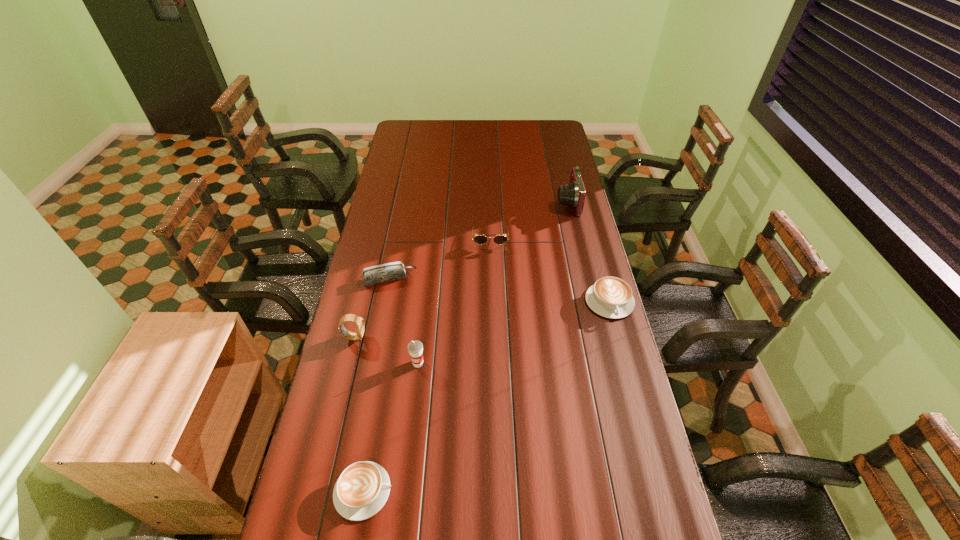
Identify the location of vacant space at the right edge of the desktop. (609, 456).

You are a GUI agent. You are given a task and a screenshot of the screen. Output one action in this format:
    pyautogui.click(x=<x>, y=<y>)
    Task: Click on the free spot at the far left corner of the desktop
    Image resolution: width=960 pixels, height=540 pixels.
    Given the screenshot: What is the action you would take?
    pyautogui.click(x=411, y=140)

Find the location of a particular element. The width and height of the screenshot is (960, 540). free space at the far right corner is located at coordinates (554, 131).

Where is `vacant space that's between the second nearest object and the fifth object from left to right`? vacant space that's between the second nearest object and the fifth object from left to right is located at coordinates tap(454, 301).

You are a GUI agent. You are given a task and a screenshot of the screen. Output one action in this format:
    pyautogui.click(x=<x>, y=<y>)
    Task: Click on the vacant area that lies between the taller cappuccino and the sunglasses
    This screenshot has width=960, height=540.
    Given the screenshot: What is the action you would take?
    pyautogui.click(x=550, y=270)

Locate an element on the screen. vacant region between the taller cappuccino and the third tallest object is located at coordinates (482, 320).

Locate an element on the screen. The height and width of the screenshot is (540, 960). free space between the left cappuccino and the farther cappuccino is located at coordinates (487, 396).

Locate an element on the screen. vacant area that lies between the cup and the camera is located at coordinates (492, 283).

Find the location of a particular element. unoccupied position between the farthest object and the sixth nearest object is located at coordinates (529, 220).

This screenshot has width=960, height=540. In order to click on unoccupied area between the taller cappuccino and the pencil box in this screenshot , I will do `click(499, 291)`.